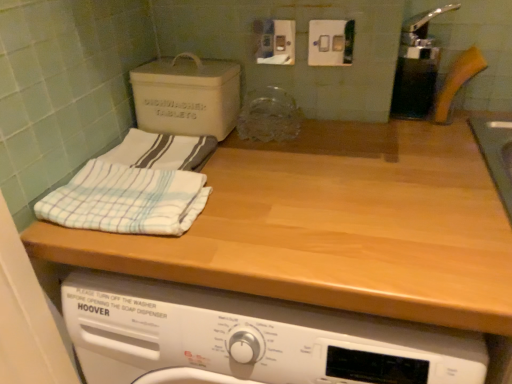
Describe the element at coordinates (334, 226) in the screenshot. I see `wooden at upper center` at that location.

The image size is (512, 384). Describe the element at coordinates (187, 96) in the screenshot. I see `matte gray cardboard box at upper left` at that location.

What do you see at coordinates (161, 151) in the screenshot? I see `white striped cloth at upper left, the second bath towel when ordered from front to back` at bounding box center [161, 151].

Where is `white striped cloth at left, which is the first bath towel from front to back`? Image resolution: width=512 pixels, height=384 pixels. white striped cloth at left, which is the first bath towel from front to back is located at coordinates (126, 200).

Is wooden at upper center behind white striped cloth at upper left, the second bath towel when ordered from front to back?

No, wooden at upper center is in front of white striped cloth at upper left, the second bath towel when ordered from front to back.

Considering the sizes of objects wooden at upper center and white striped cloth at upper left, the second bath towel when ordered from front to back, in the image provided, who is smaller, wooden at upper center or white striped cloth at upper left, the second bath towel when ordered from front to back,?

white striped cloth at upper left, the second bath towel when ordered from front to back, is smaller.

Is there a large distance between wooden at upper center and white striped cloth at upper left, the second bath towel when ordered from front to back?

No, wooden at upper center is in close proximity to white striped cloth at upper left, the second bath towel when ordered from front to back.

Find the location of a particular element. The image size is (512, 384). countertop to the right of white striped cloth at upper left, which is the 1th bath towel in back-to-front order is located at coordinates (334, 226).

Which object is wider, matte gray cardboard box at upper left or white striped cloth at left, which is the first bath towel from front to back?

matte gray cardboard box at upper left.

Considering the relative sizes of matte gray cardboard box at upper left and white striped cloth at left, the second bath towel from the back, in the image provided, is matte gray cardboard box at upper left smaller than white striped cloth at left, the second bath towel from the back,?

No.

Considering the points (170, 126) and (106, 200), which point is behind, point (170, 126) or point (106, 200)?

The point (170, 126) is more distant.

Visually, is wooden at upper center positioned to the left or to the right of matte gray cardboard box at upper left?

Based on their positions, wooden at upper center is located to the right of matte gray cardboard box at upper left.

From a real-world perspective, which object rests below the other?

wooden at upper center is physically lower.

Which is in front, wooden at upper center or matte gray cardboard box at upper left?

wooden at upper center is closer to the camera.

From their relative heights in the image, would you say wooden at upper center is taller or shorter than matte gray cardboard box at upper left?

Clearly, wooden at upper center is taller compared to matte gray cardboard box at upper left.

Based on the photo, which object is further away from the camera, matte gray cardboard box at upper left or wooden at upper center?

matte gray cardboard box at upper left is behind.

Between matte gray cardboard box at upper left and wooden at upper center, which one appears on the right side from the viewer's perspective?

wooden at upper center.

Is matte gray cardboard box at upper left far away from wooden at upper center?

That's not correct — matte gray cardboard box at upper left is a little close to wooden at upper center.

Locate an element on the screen. cardboard box above the wooden at upper center (from a real-world perspective) is located at coordinates (187, 96).

Can you confirm if white striped cloth at left, the second bath towel from the back, is wider than wooden at upper center?

No, white striped cloth at left, the second bath towel from the back, is not wider than wooden at upper center.

Based on the photo, from the image's perspective, does white striped cloth at left, the second bath towel from the back, appear lower than wooden at upper center?

Incorrect, from the image's perspective, white striped cloth at left, the second bath towel from the back, is higher than wooden at upper center.

Who is taller, white striped cloth at left, the second bath towel from the back, or wooden at upper center?

wooden at upper center.

Can you confirm if white striped cloth at left, which is the first bath towel from front to back, is smaller than wooden at upper center?

Yes.

From the picture: Is white striped cloth at upper left, which is the 1th bath towel in back-to-front order, taller or shorter than wooden at upper center?

Considering their sizes, white striped cloth at upper left, which is the 1th bath towel in back-to-front order, has less height than wooden at upper center.

From the image's perspective, is white striped cloth at upper left, which is the 1th bath towel in back-to-front order, below wooden at upper center?

No, from the image's perspective, white striped cloth at upper left, which is the 1th bath towel in back-to-front order, is not below wooden at upper center.

How different are the orientations of white striped cloth at upper left, the second bath towel when ordered from front to back, and wooden at upper center in degrees?

0.722 degrees separate the facing orientations of white striped cloth at upper left, the second bath towel when ordered from front to back, and wooden at upper center.

Is white striped cloth at upper left, which is the 1th bath towel in back-to-front order, outside of wooden at upper center?

white striped cloth at upper left, which is the 1th bath towel in back-to-front order, lies outside wooden at upper center's area.

From the image's perspective, which one is positioned lower, white striped cloth at upper left, the second bath towel when ordered from front to back, or white striped cloth at left, the second bath towel from the back?

white striped cloth at left, the second bath towel from the back, from the image's perspective.

Can you see white striped cloth at upper left, which is the 1th bath towel in back-to-front order, touching white striped cloth at left, the second bath towel from the back?

Yes, white striped cloth at upper left, which is the 1th bath towel in back-to-front order, and white striped cloth at left, the second bath towel from the back, clearly make contact.

At what (x,y) coordinates should I click in order to perform the action: click on the 2nd bath towel above the wooden at upper center (from the image's perspective). Please return your answer as a coordinate pair (x, y). Looking at the image, I should click on (161, 151).

Where is `cardboard box located behind the white striped cloth at left, the second bath towel from the back`? The height and width of the screenshot is (384, 512). cardboard box located behind the white striped cloth at left, the second bath towel from the back is located at coordinates (187, 96).

In the scene shown: Estimate the real-world distances between objects in this image. Which object is further from wooden at upper center, white striped cloth at left, the second bath towel from the back, or matte gray cardboard box at upper left?

Among the two, matte gray cardboard box at upper left is located further to wooden at upper center.

When comparing their distances from white striped cloth at left, the second bath towel from the back, does wooden at upper center or white striped cloth at upper left, the second bath towel when ordered from front to back, seem further?

Among the two, wooden at upper center is located further to white striped cloth at left, the second bath towel from the back.

Looking at the image, which one is located closer to wooden at upper center, white striped cloth at upper left, the second bath towel when ordered from front to back, or white striped cloth at left, which is the first bath towel from front to back?

The object closer to wooden at upper center is white striped cloth at left, which is the first bath towel from front to back.

Looking at the image, which one is located closer to matte gray cardboard box at upper left, wooden at upper center or white striped cloth at left, the second bath towel from the back?

Based on the image, white striped cloth at left, the second bath towel from the back, appears to be nearer to matte gray cardboard box at upper left.

Considering their positions, is white striped cloth at upper left, the second bath towel when ordered from front to back, positioned further to wooden at upper center than matte gray cardboard box at upper left?

matte gray cardboard box at upper left lies further to wooden at upper center than the other object.

Considering their positions, is wooden at upper center positioned further to white striped cloth at left, the second bath towel from the back, than matte gray cardboard box at upper left?

The object further to white striped cloth at left, the second bath towel from the back, is matte gray cardboard box at upper left.

When comparing their distances from matte gray cardboard box at upper left, does white striped cloth at upper left, the second bath towel when ordered from front to back, or white striped cloth at left, which is the first bath towel from front to back, seem closer?

white striped cloth at upper left, the second bath towel when ordered from front to back, is positioned closer to the anchor matte gray cardboard box at upper left.

Looking at the image, which one is located closer to white striped cloth at left, the second bath towel from the back, white striped cloth at upper left, the second bath towel when ordered from front to back, or wooden at upper center?

Based on the image, white striped cloth at upper left, the second bath towel when ordered from front to back, appears to be nearer to white striped cloth at left, the second bath towel from the back.

Locate an element on the screen. bath towel positioned between white striped cloth at left, which is the first bath towel from front to back, and matte gray cardboard box at upper left from near to far is located at coordinates (161, 151).

Identify the location of bath towel between white striped cloth at upper left, the second bath towel when ordered from front to back, and wooden at upper center from top to bottom. The height and width of the screenshot is (384, 512). (126, 200).